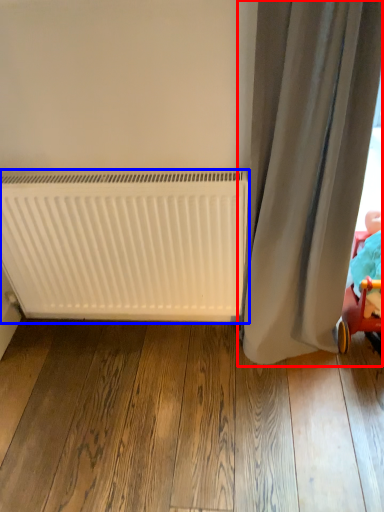
Question: Which point is further to the camera, curtain (highlighted by a red box) or radiator (highlighted by a blue box)?

Choices:
 (A) curtain
 (B) radiator

Answer: (B)